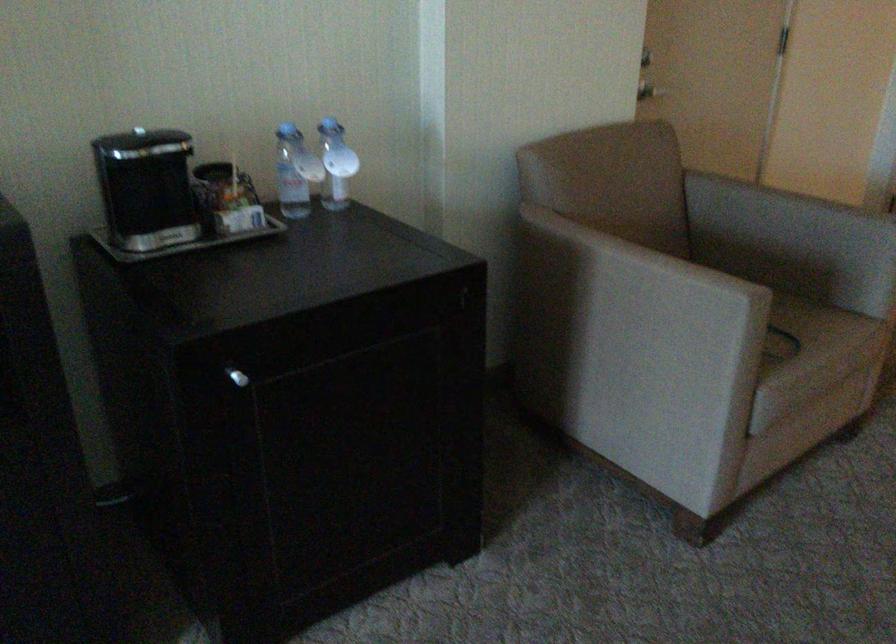
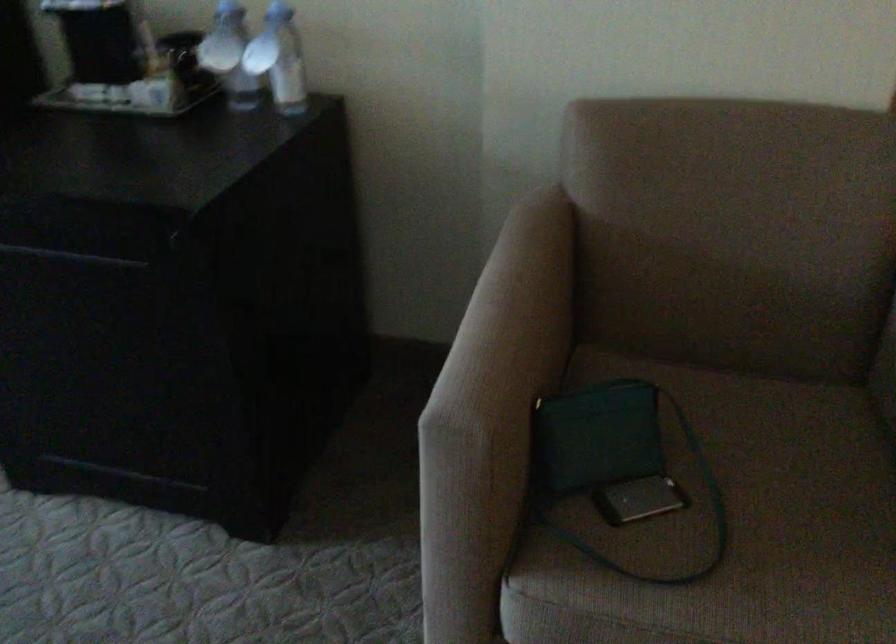
Where in the second image is the point corresponding to (305,169) from the first image?

(229, 55)